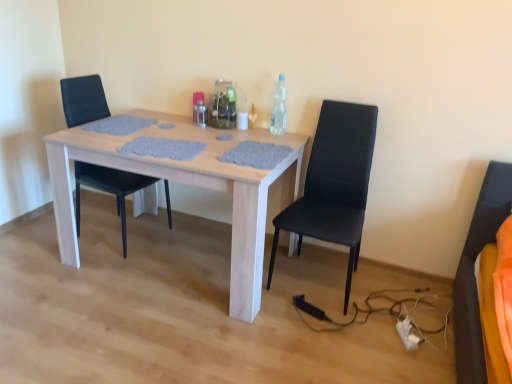
Identify the location of vacant space in front of light wood table at center. (157, 338).